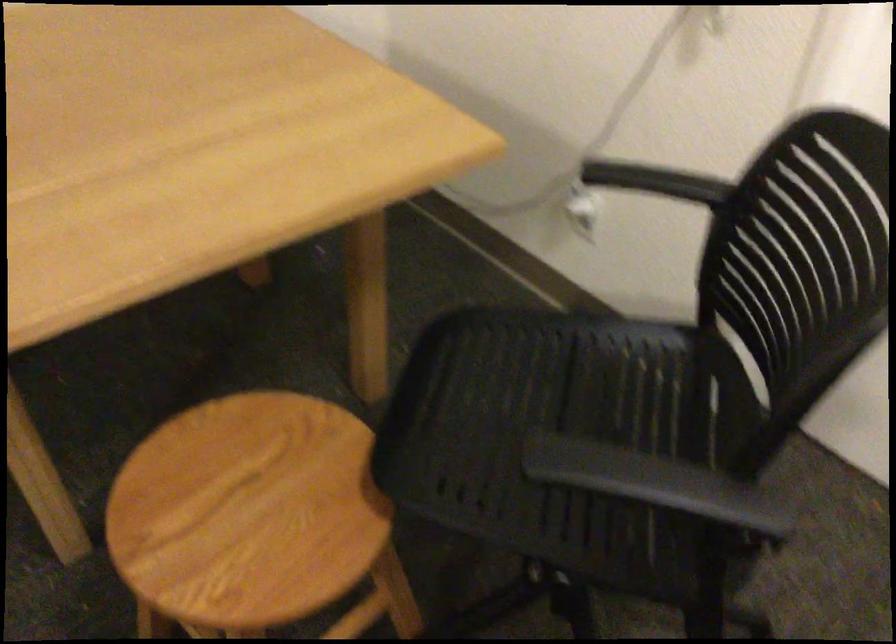
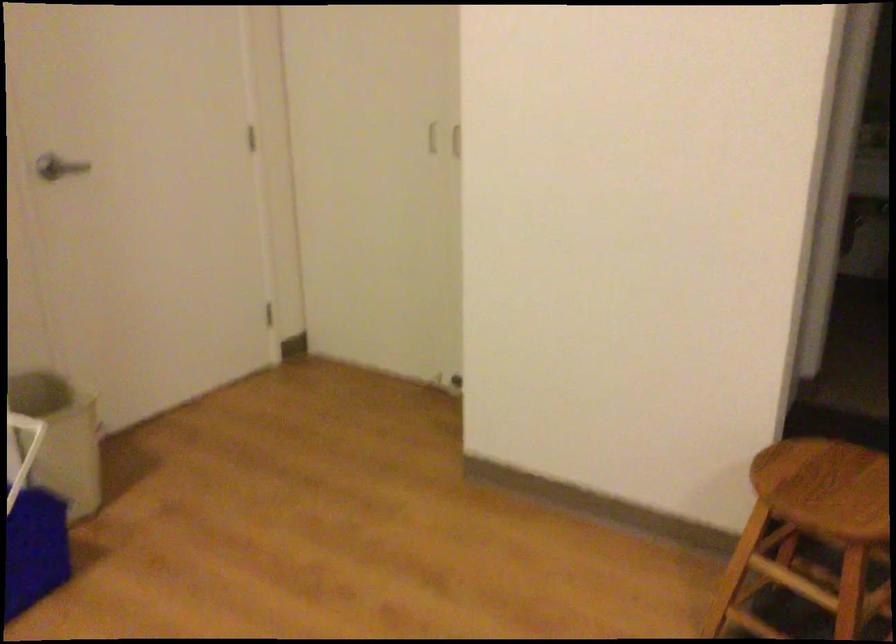
Question: The camera is either moving clockwise (left) or counter-clockwise (right) around the object. The first image is from the beginning of the video and the second image is from the end. Is the camera moving left or right when shooting the video?

Choices:
 (A) Left
 (B) Right

Answer: (B)